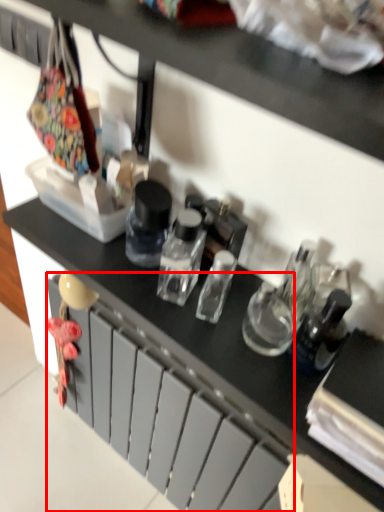
Question: Considering the relative positions of drawer (annotated by the red box) and bottle in the image provided, where is drawer (annotated by the red box) located with respect to the staircase?

Choices:
 (A) left
 (B) right

Answer: (A)